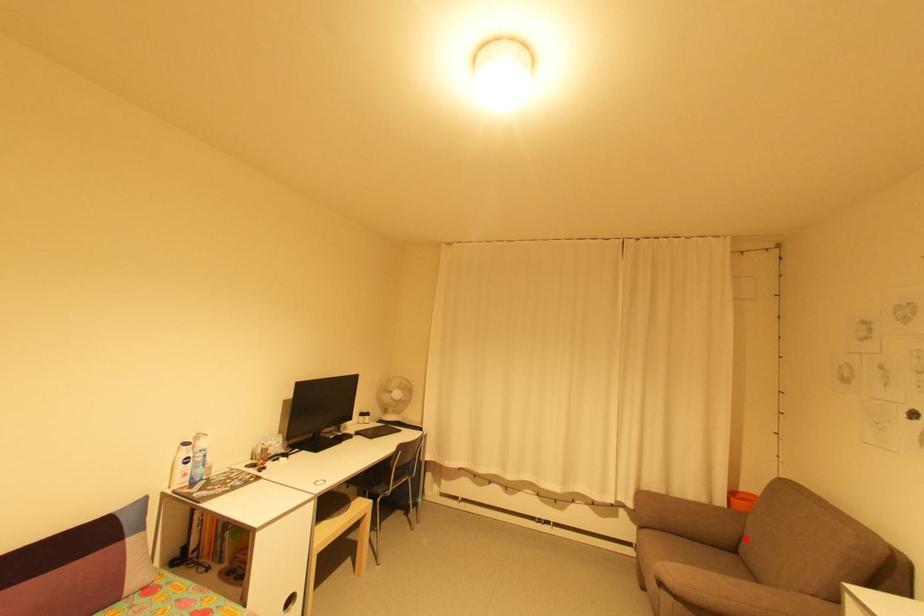
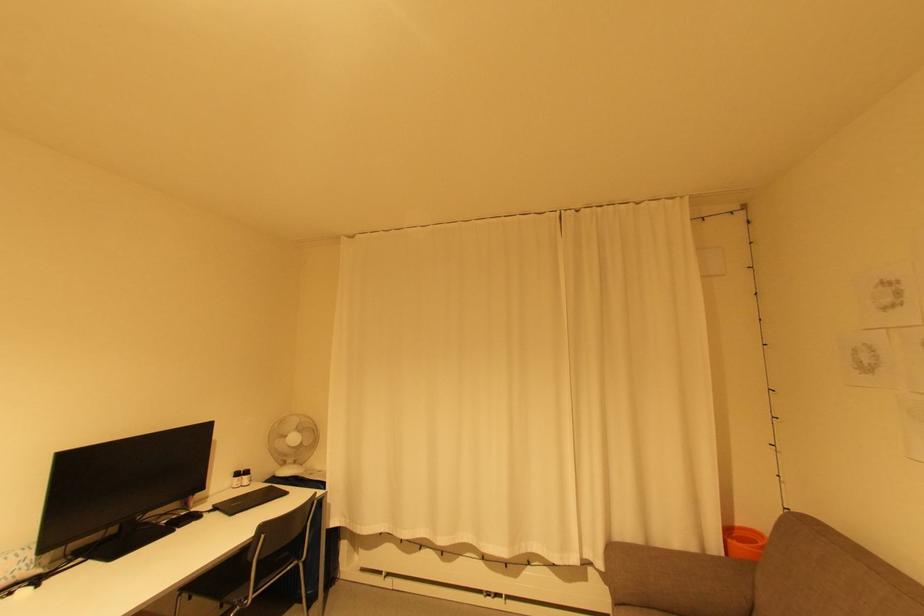
Locate, in the second image, the point that corresponds to the highlighted location in the first image.

(757, 609)